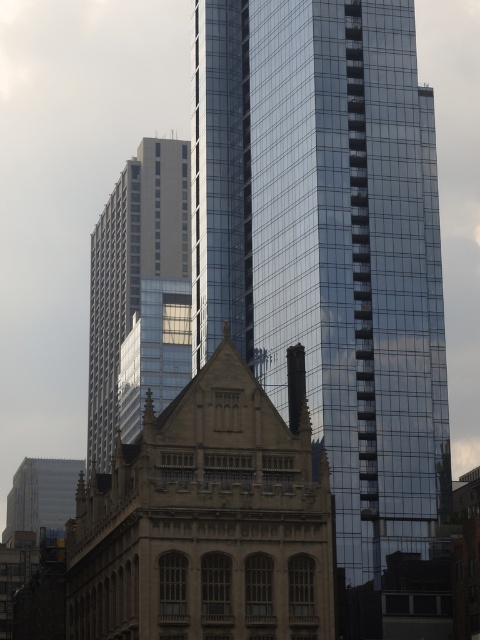
Between point (379, 221) and point (116, 392), which one is positioned behind?

Point (116, 392)

What do you see at coordinates (328, 244) in the screenshot?
I see `brown stone bell tower at center` at bounding box center [328, 244].

The width and height of the screenshot is (480, 640). Identify the location of brown stone bell tower at center. (328, 244).